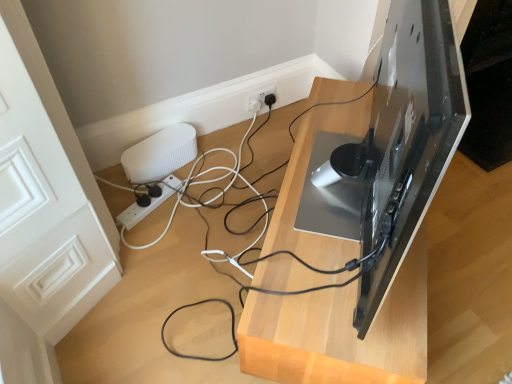
You are a GUI agent. You are given a task and a screenshot of the screen. Output one action in this format:
    pyautogui.click(x=<x>, y=<y>)
    Task: Click on the blank space situated above black glossy tv stand at upper right (from a real-world perspective)
    
    Given the screenshot: What is the action you would take?
    pyautogui.click(x=334, y=201)